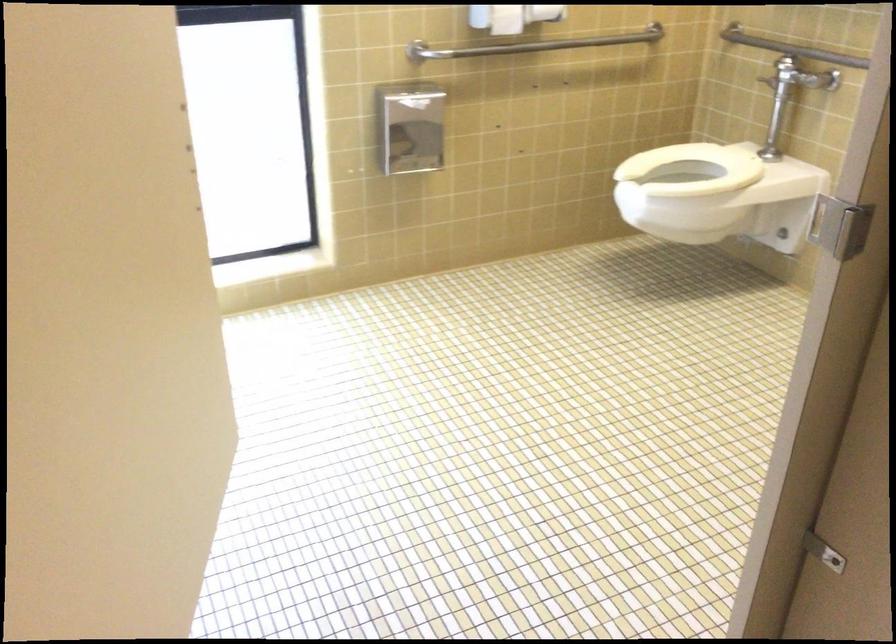
The height and width of the screenshot is (644, 896). Find the location of `metal grab bar`. metal grab bar is located at coordinates (531, 44).